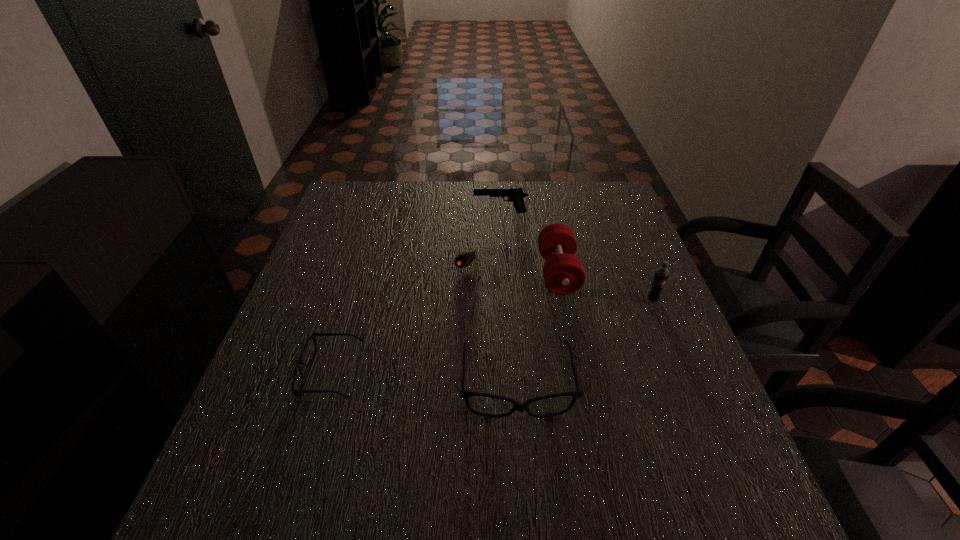
Given the evenly spaced spectacless in the image, where should an extra spectacles be added on the right to preserve the spacing? Please point to a vacant space. Please provide its 2D coordinates. Your answer should be formatted as a tuple, i.e. [(x, y)], where the tuple contains the x and y coordinates of a point satisfying the conditions above.

[(712, 396)]